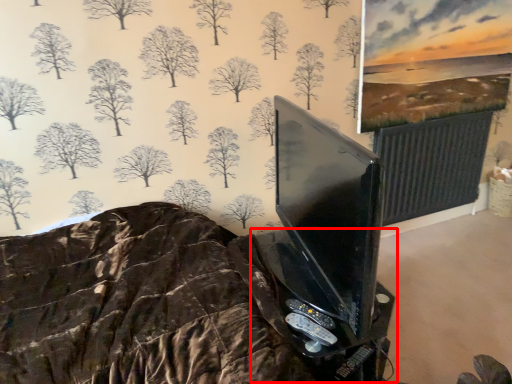
Question: Considering the relative positions of table (annotated by the red box) and game controller in the image provided, where is table (annotated by the red box) located with respect to the staircase?

Choices:
 (A) right
 (B) left

Answer: (A)